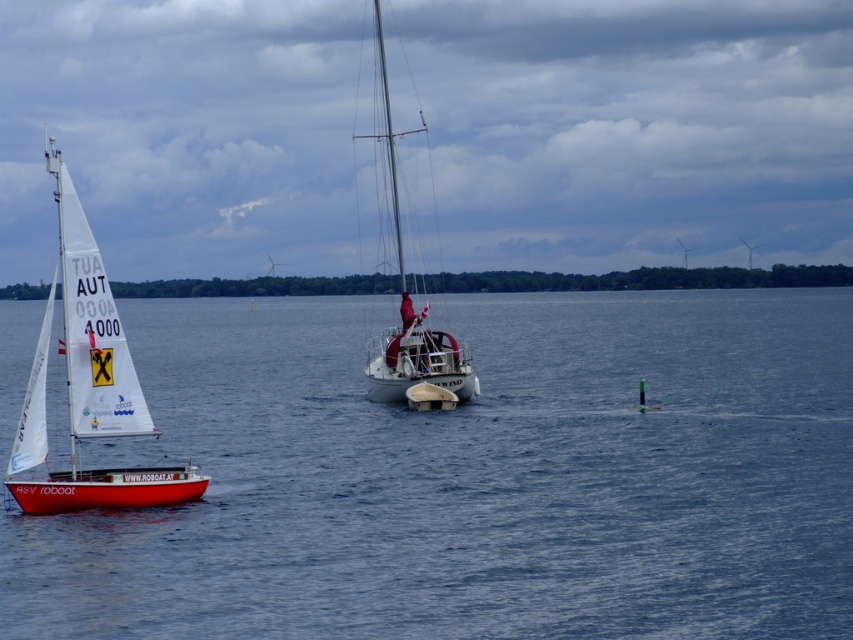
Question: Which is farther from the white sailboat at left?

Choices:
 (A) blue water at center
 (B) white glossy sailboat at center

Answer: (A)

Question: Does blue water at center appear over white glossy sailboat at center?

Choices:
 (A) no
 (B) yes

Answer: (A)

Question: Is white sailboat at left positioned before white glossy sailboat at center?

Choices:
 (A) yes
 (B) no

Answer: (A)

Question: Observing the image, what is the correct spatial positioning of blue water at center in reference to white glossy sailboat at center?

Choices:
 (A) left
 (B) right

Answer: (B)

Question: Estimate the real-world distances between objects in this image. Which object is farther from the white sailboat at left?

Choices:
 (A) blue water at center
 (B) white glossy sailboat at center

Answer: (A)

Question: Which point is closer to the camera?

Choices:
 (A) blue water at center
 (B) white glossy sailboat at center

Answer: (A)